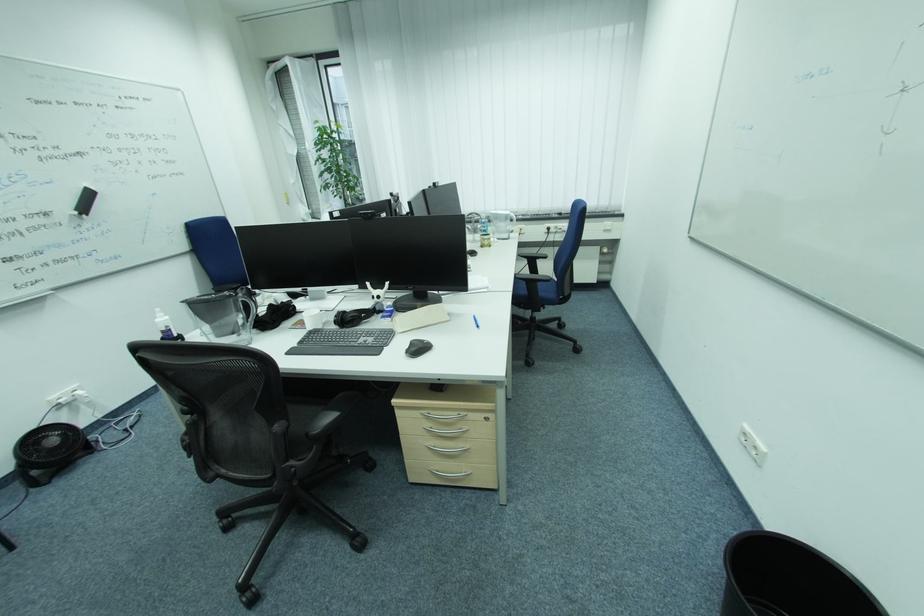
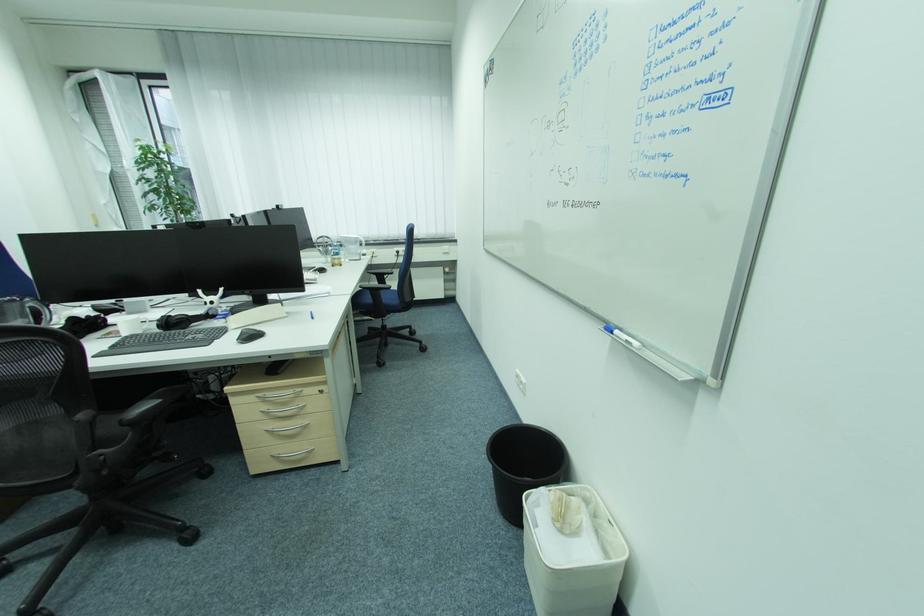
In the second image, find the point that corresponds to (531,257) in the first image.

(381, 275)